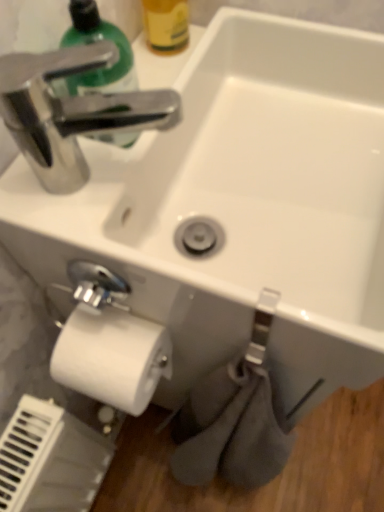
Find the location of a particular element. The width and height of the screenshot is (384, 512). shiny green plastic soap dispenser at upper left is located at coordinates (93, 42).

Describe the element at coordinates (112, 357) in the screenshot. I see `white matte toilet paper at lower left` at that location.

Image resolution: width=384 pixels, height=512 pixels. Identify the location of yellow matte bottle at upper center. (166, 24).

Locate an element on the screen. shiny green plastic soap dispenser at upper left is located at coordinates (93, 42).

Would you consider white matte toilet paper at lower left to be distant from shiny green plastic soap dispenser at upper left?

That's not correct — white matte toilet paper at lower left is a little close to shiny green plastic soap dispenser at upper left.

Considering the relative sizes of white matte toilet paper at lower left and shiny green plastic soap dispenser at upper left in the image provided, is white matte toilet paper at lower left shorter than shiny green plastic soap dispenser at upper left?

Yes.

From a real-world perspective, is white matte toilet paper at lower left positioned above or below shiny green plastic soap dispenser at upper left?

In terms of real-world spatial position, white matte toilet paper at lower left is below shiny green plastic soap dispenser at upper left.

Is white matte toilet paper at lower left oriented towards shiny green plastic soap dispenser at upper left?

No, white matte toilet paper at lower left is not aimed at shiny green plastic soap dispenser at upper left.

Consider the image. Is shiny green plastic soap dispenser at upper left thinner than white matte toilet paper at lower left?

Correct, the width of shiny green plastic soap dispenser at upper left is less than that of white matte toilet paper at lower left.

Is shiny green plastic soap dispenser at upper left placed right next to white matte toilet paper at lower left?

No, shiny green plastic soap dispenser at upper left is not making contact with white matte toilet paper at lower left.

I want to click on toilet paper to the right of shiny green plastic soap dispenser at upper left, so click(x=112, y=357).

Which is farther, (145, 10) or (101, 31)?

The point (145, 10) is farther.

Is yellow matte bottle at upper center further to camera compared to shiny green plastic soap dispenser at upper left?

Yes, it is behind shiny green plastic soap dispenser at upper left.

Is shiny green plastic soap dispenser at upper left at the back of yellow matte bottle at upper center?

No, yellow matte bottle at upper center's orientation is not away from shiny green plastic soap dispenser at upper left.

Can you confirm if yellow matte bottle at upper center is wider than shiny green plastic soap dispenser at upper left?

No, yellow matte bottle at upper center is not wider than shiny green plastic soap dispenser at upper left.

Is yellow matte bottle at upper center oriented towards white matte toilet paper at lower left?

No, yellow matte bottle at upper center does not turn towards white matte toilet paper at lower left.

Would you consider yellow matte bottle at upper center to be distant from white matte toilet paper at lower left?

No, yellow matte bottle at upper center is not far from white matte toilet paper at lower left.

Who is bigger, yellow matte bottle at upper center or white matte toilet paper at lower left?

Bigger between the two is white matte toilet paper at lower left.

From a real-world perspective, between yellow matte bottle at upper center and white matte toilet paper at lower left, who is vertically lower?

white matte toilet paper at lower left, from a real-world perspective.

Does shiny green plastic soap dispenser at upper left turn towards yellow matte bottle at upper center?

No, shiny green plastic soap dispenser at upper left is not turned towards yellow matte bottle at upper center.

Where is `cleaning product in front of the yellow matte bottle at upper center`? The height and width of the screenshot is (512, 384). cleaning product in front of the yellow matte bottle at upper center is located at coordinates coord(93,42).

Is shiny green plastic soap dispenser at upper left completely or partially outside of yellow matte bottle at upper center?

Indeed, shiny green plastic soap dispenser at upper left is completely outside yellow matte bottle at upper center.

Is shiny green plastic soap dispenser at upper left touching yellow matte bottle at upper center?

They are not placed beside each other.

The image size is (384, 512). In order to click on bottle that appears above the white matte toilet paper at lower left (from a real-world perspective) in this screenshot , I will do `click(166, 24)`.

Which object is thinner, white matte toilet paper at lower left or yellow matte bottle at upper center?

With smaller width is yellow matte bottle at upper center.

Looking at this image, from the image's perspective, is white matte toilet paper at lower left located above or below yellow matte bottle at upper center?

white matte toilet paper at lower left is below yellow matte bottle at upper center.

Considering the relative sizes of white matte toilet paper at lower left and yellow matte bottle at upper center in the image provided, is white matte toilet paper at lower left bigger than yellow matte bottle at upper center?

Indeed, white matte toilet paper at lower left has a larger size compared to yellow matte bottle at upper center.

Locate an element on the screen. toilet paper below the shiny green plastic soap dispenser at upper left (from the image's perspective) is located at coordinates (112, 357).

Locate an element on the screen. This screenshot has height=512, width=384. cleaning product that is in front of the white matte toilet paper at lower left is located at coordinates (93, 42).

From the image, which object appears to be nearer to yellow matte bottle at upper center, white matte toilet paper at lower left or shiny green plastic soap dispenser at upper left?

The object closer to yellow matte bottle at upper center is shiny green plastic soap dispenser at upper left.

Estimate the real-world distances between objects in this image. Which object is further from white matte toilet paper at lower left, shiny green plastic soap dispenser at upper left or yellow matte bottle at upper center?

yellow matte bottle at upper center.

Looking at this image, considering their positions, is shiny green plastic soap dispenser at upper left positioned further to yellow matte bottle at upper center than white matte toilet paper at lower left?

white matte toilet paper at lower left.

Based on their spatial positions, is yellow matte bottle at upper center or white matte toilet paper at lower left closer to shiny green plastic soap dispenser at upper left?

Among the two, yellow matte bottle at upper center is located nearer to shiny green plastic soap dispenser at upper left.

From the image, which object appears to be nearer to white matte toilet paper at lower left, yellow matte bottle at upper center or shiny green plastic soap dispenser at upper left?

shiny green plastic soap dispenser at upper left is positioned closer to the anchor white matte toilet paper at lower left.

Estimate the real-world distances between objects in this image. Which object is closer to shiny green plastic soap dispenser at upper left, white matte toilet paper at lower left or yellow matte bottle at upper center?

yellow matte bottle at upper center lies closer to shiny green plastic soap dispenser at upper left than the other object.

Identify the location of cleaning product between yellow matte bottle at upper center and white matte toilet paper at lower left in the vertical direction. (93, 42).